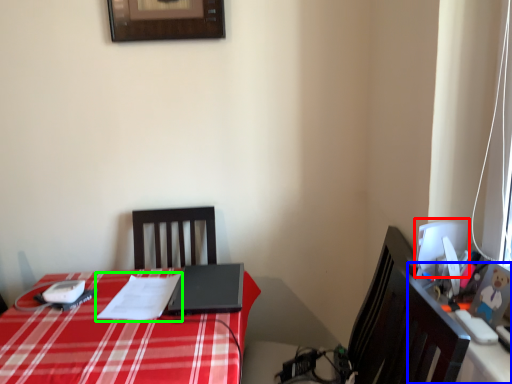
Question: Estimate the real-world distances between objects in this image. Which object is closer to computer monitor (highlighted by a red box), computer desk (highlighted by a blue box) or notepad (highlighted by a green box)?

Choices:
 (A) computer desk
 (B) notepad

Answer: (A)